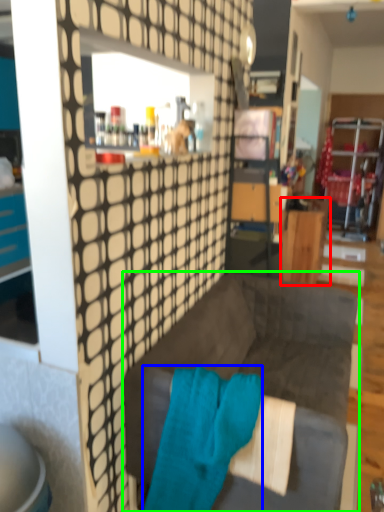
Question: Based on their relative distances, which object is nearer to desk (highlighted by a red box)? Choose from bath towel (highlighted by a blue box) and studio couch (highlighted by a green box).

Choices:
 (A) bath towel
 (B) studio couch

Answer: (B)